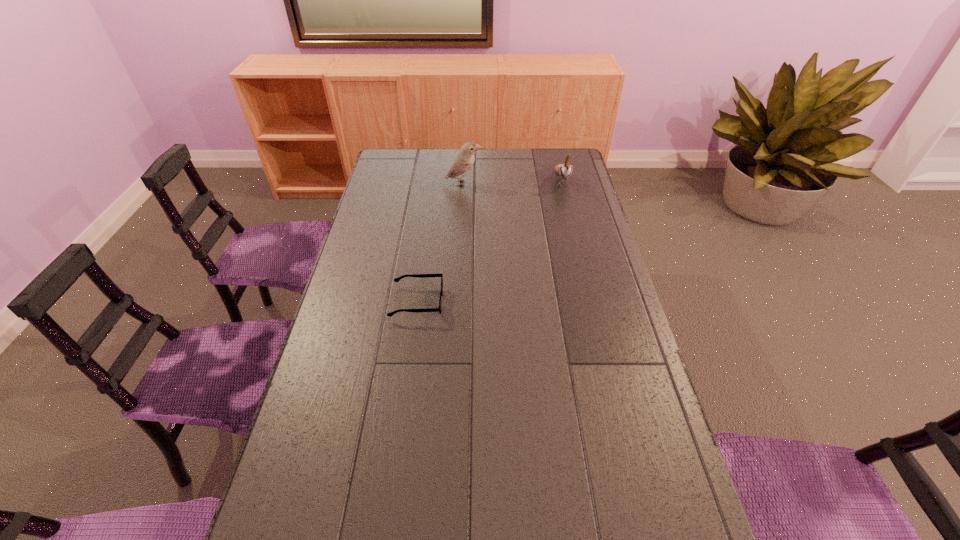
This screenshot has width=960, height=540. Find the location of `the left bird`. the left bird is located at coordinates (463, 162).

This screenshot has height=540, width=960. In order to click on the right bird in this screenshot , I will do `click(565, 170)`.

Find the location of a particular element. The width and height of the screenshot is (960, 540). spectacles is located at coordinates (398, 279).

Where is `the shortest object`? the shortest object is located at coordinates (398, 279).

I want to click on free space located at the face of the left bird, so click(x=557, y=184).

Identify the location of free space located 0.130m at the face of the rightmost object. Image resolution: width=960 pixels, height=540 pixels. (569, 213).

Where is `vacant region located 0.260m on the arms of the nearest object`? vacant region located 0.260m on the arms of the nearest object is located at coordinates (525, 302).

I want to click on object that is at the far edge, so click(x=565, y=170).

Locate an element on the screen. object that is at the right edge is located at coordinates (565, 170).

Locate an element on the screen. object at the far right corner is located at coordinates (565, 170).